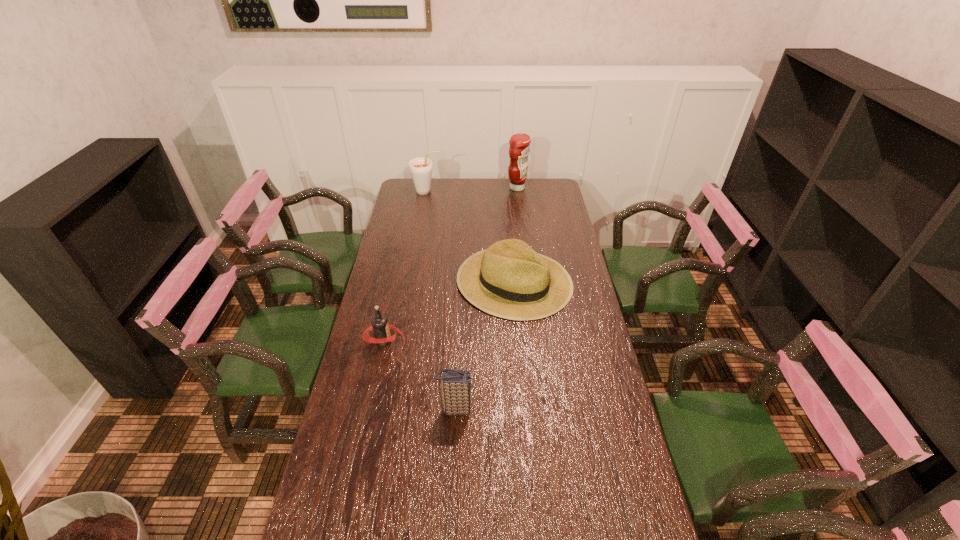
Locate an element on the screen. Image resolution: width=960 pixels, height=540 pixels. condiment is located at coordinates (519, 149).

In order to click on the fourth shortest object in this screenshot , I will do coord(420,167).

You are a GUI agent. You are given a task and a screenshot of the screen. Output one action in this format:
    pyautogui.click(x=<x>, y=<y>)
    Task: Click on the farther root beer
    The width and height of the screenshot is (960, 540).
    Given the screenshot: What is the action you would take?
    pyautogui.click(x=420, y=167)

Find the location of a particular element. the nearest object is located at coordinates (455, 384).

This screenshot has width=960, height=540. I want to click on the nearer root beer, so click(x=380, y=326).

Find the location of a particular element. The width and height of the screenshot is (960, 540). the second nearest object is located at coordinates (380, 326).

In order to click on the third nearest object in this screenshot , I will do `click(510, 280)`.

Image resolution: width=960 pixels, height=540 pixels. Find the location of `vacant space situated 0.400m on the left of the tallest object`. vacant space situated 0.400m on the left of the tallest object is located at coordinates (432, 188).

You are a GUI agent. You are given a task and a screenshot of the screen. Output one action in this format:
    pyautogui.click(x=<x>, y=<y>)
    Task: Click on the vacant region located 0.390m on the drink side of the farther root beer
    
    Given the screenshot: What is the action you would take?
    pyautogui.click(x=516, y=192)

Locate an element on the screen. The height and width of the screenshot is (540, 960). vacant space located with the zip open on the nearest object is located at coordinates pyautogui.click(x=595, y=409).